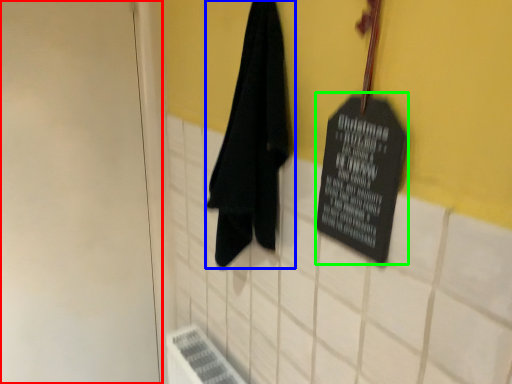
Question: Estimate the real-world distances between objects in this image. Which object is closer to door (highlighted by a red box), towel (highlighted by a blue box) or bulletin board (highlighted by a green box)?

Choices:
 (A) towel
 (B) bulletin board

Answer: (A)